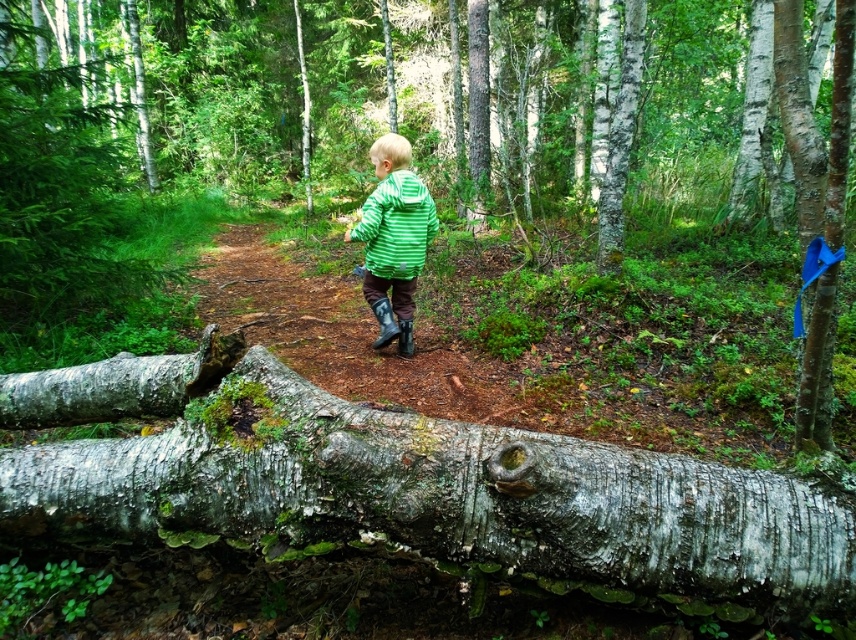
You are the child in the forest scene. You notice two points in front of you. The first point is at coordinates point (250, 54), and the second is at point (385, 296). Which point is closer to you?

Point (250, 54) is closer to you because it is further to the viewer than point (385, 296).

From the picture: Based on the scene description, if you were to compare the height of the smooth bark log at lower center and the smooth gray bark at center, which one appears taller?

The smooth bark log at lower center is much taller than the smooth gray bark at center.

You are the child in the forest scene. You notice the smooth bark log at lower center and the green striped jacket at center. Which object is located to the left of the other?

The smooth bark log at lower center is positioned on the left side of green striped jacket at center.